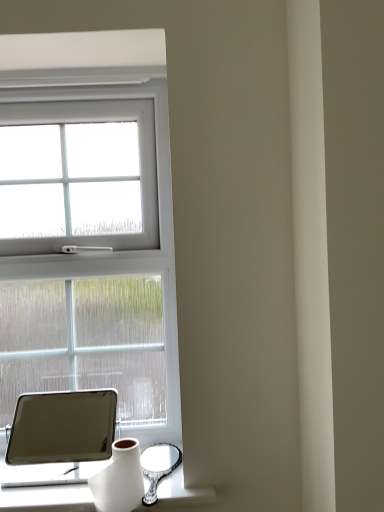
Question: Is matte black tablet at lower left not near white glossy vase at lower left?

Choices:
 (A) no
 (B) yes

Answer: (B)

Question: Considering the relative positions of matte black tablet at lower left and white glossy vase at lower left in the image provided, is matte black tablet at lower left in front of white glossy vase at lower left?

Choices:
 (A) yes
 (B) no

Answer: (B)

Question: Does matte black tablet at lower left have a greater width compared to white glossy vase at lower left?

Choices:
 (A) no
 (B) yes

Answer: (B)

Question: From a real-world perspective, is matte black tablet at lower left located higher than white glossy vase at lower left?

Choices:
 (A) yes
 (B) no

Answer: (A)

Question: Is the depth of matte black tablet at lower left greater than that of white glossy vase at lower left?

Choices:
 (A) yes
 (B) no

Answer: (A)

Question: From a real-world perspective, is matte black tablet at lower left positioned under white glossy vase at lower left based on gravity?

Choices:
 (A) yes
 (B) no

Answer: (B)

Question: Is white glossy vase at lower left at the right side of matte black tablet at lower left?

Choices:
 (A) no
 (B) yes

Answer: (B)

Question: Is white glossy vase at lower left at the left side of matte black tablet at lower left?

Choices:
 (A) no
 (B) yes

Answer: (A)

Question: From the image's perspective, is white glossy vase at lower left on top of matte black tablet at lower left?

Choices:
 (A) yes
 (B) no

Answer: (B)

Question: Can you confirm if white glossy vase at lower left is shorter than matte black tablet at lower left?

Choices:
 (A) yes
 (B) no

Answer: (A)

Question: Is white glossy vase at lower left aimed at matte black tablet at lower left?

Choices:
 (A) no
 (B) yes

Answer: (A)

Question: Is white glossy vase at lower left turned away from matte black tablet at lower left?

Choices:
 (A) yes
 (B) no

Answer: (A)

Question: From a real-world perspective, is white glossy vase at lower left physically located above or below matte black tablet at lower left?

Choices:
 (A) above
 (B) below

Answer: (B)